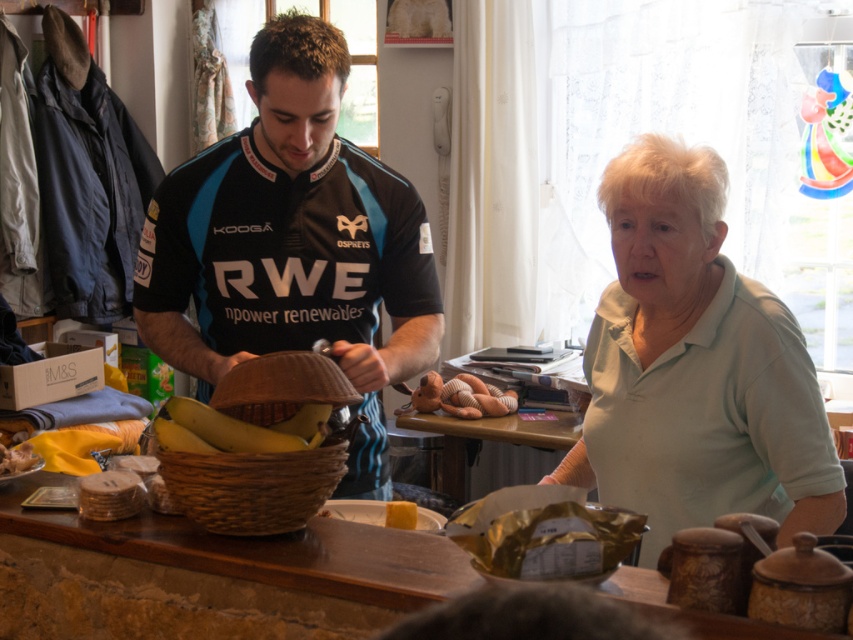
Who is higher up, matte black jersey at center or yellow wax candle at center?

matte black jersey at center

Measure the distance between point (180,308) and camera.

Point (180,308) is 1.85 meters from camera.

This screenshot has width=853, height=640. Identify the location of matte black jersey at center. point(698,364).

You are a GUI agent. You are given a task and a screenshot of the screen. Output one action in this format:
    pyautogui.click(x=<x>, y=<y>)
    Task: Click on the light green cotton shirt at center
    The height and width of the screenshot is (640, 853).
    Given the screenshot: What is the action you would take?
    pyautogui.click(x=695, y=365)

Can you confirm if light green cotton shirt at center is positioned to the right of woven wood table at center?

Indeed, light green cotton shirt at center is positioned on the right side of woven wood table at center.

Is point (665, 518) more distant than point (45, 480)?

No, (665, 518) is closer to viewer.

Find the location of a particular element. light green cotton shirt at center is located at coordinates (695, 365).

Is black jersey at center thinner than yellow matte bananas at center?

In fact, black jersey at center might be wider than yellow matte bananas at center.

Does black jersey at center have a larger size compared to yellow matte bananas at center?

Yes, black jersey at center is bigger than yellow matte bananas at center.

Which is in front, point (416, 342) or point (155, 426)?

Point (155, 426) is in front.

Where is `black jersey at center`? The width and height of the screenshot is (853, 640). black jersey at center is located at coordinates (292, 244).